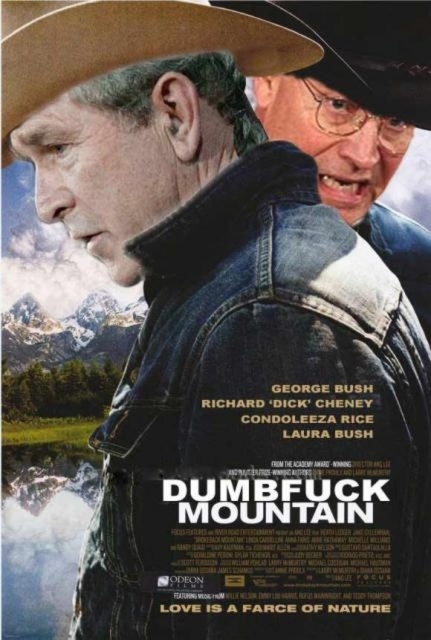
Question: Can you confirm if denim jacket at center is positioned to the left of brown leather cowboy hat at upper center?

Choices:
 (A) no
 (B) yes

Answer: (B)

Question: Is denim jacket at center smaller than brown leather cowboy hat at upper center?

Choices:
 (A) no
 (B) yes

Answer: (A)

Question: Which object appears closest to the camera in this image?

Choices:
 (A) brown felt cowboy hat at upper left
 (B) brown leather cowboy hat at upper center
 (C) denim jacket at center

Answer: (C)

Question: Which of the following is the closest to the observer?

Choices:
 (A) (199, 193)
 (B) (428, 93)

Answer: (A)

Question: Does denim jacket at center appear on the right side of brown leather cowboy hat at upper center?

Choices:
 (A) yes
 (B) no

Answer: (B)

Question: Which object is farther from the camera taking this photo?

Choices:
 (A) brown leather cowboy hat at upper center
 (B) denim jacket at center

Answer: (A)